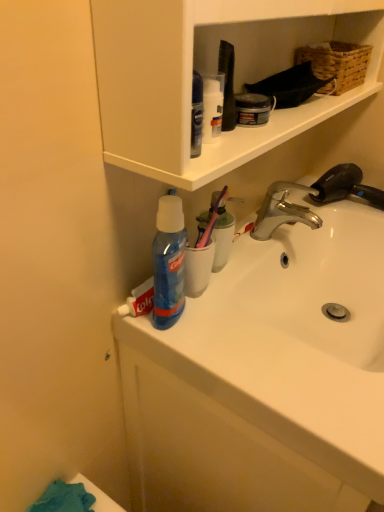
Question: Can you confirm if chrome metallic faucet at upper right is smaller than white glossy sink at center, arranged as the 2th sink when viewed from the top?

Choices:
 (A) no
 (B) yes

Answer: (B)

Question: Is chrome metallic faucet at upper right to the right of white glossy sink at center, arranged as the first sink when ordered from the bottom, from the viewer's perspective?

Choices:
 (A) no
 (B) yes

Answer: (A)

Question: Could you tell me if chrome metallic faucet at upper right is turned towards white glossy sink at center, arranged as the 2th sink when viewed from the top?

Choices:
 (A) yes
 (B) no

Answer: (B)

Question: Does chrome metallic faucet at upper right have a larger size compared to white glossy sink at center, arranged as the first sink when ordered from the bottom?

Choices:
 (A) no
 (B) yes

Answer: (A)

Question: Considering the relative sizes of chrome metallic faucet at upper right and white glossy sink at center, arranged as the first sink when ordered from the bottom, in the image provided, is chrome metallic faucet at upper right thinner than white glossy sink at center, arranged as the first sink when ordered from the bottom,?

Choices:
 (A) no
 (B) yes

Answer: (B)

Question: Is chrome metallic faucet at upper right looking in the opposite direction of white glossy sink at center, arranged as the first sink when ordered from the bottom?

Choices:
 (A) yes
 (B) no

Answer: (B)

Question: Does white glossy sink at center, the 2th sink from the bottom, have a lesser width compared to white glossy sink at center, arranged as the first sink when ordered from the bottom?

Choices:
 (A) yes
 (B) no

Answer: (A)

Question: Is white glossy sink at center, the 2th sink from the bottom, further to camera compared to white glossy sink at center, arranged as the first sink when ordered from the bottom?

Choices:
 (A) yes
 (B) no

Answer: (A)

Question: Does white glossy sink at center, placed as the 1th sink when sorted from top to bottom, have a greater width compared to white glossy sink at center, arranged as the first sink when ordered from the bottom?

Choices:
 (A) yes
 (B) no

Answer: (B)

Question: Is white glossy sink at center, placed as the 1th sink when sorted from top to bottom, at the left side of white glossy sink at center, arranged as the first sink when ordered from the bottom?

Choices:
 (A) no
 (B) yes

Answer: (A)

Question: Does white glossy sink at center, the 2th sink from the bottom, have a larger size compared to white glossy sink at center, arranged as the first sink when ordered from the bottom?

Choices:
 (A) no
 (B) yes

Answer: (A)

Question: From a real-world perspective, is white glossy sink at center, the 2th sink from the bottom, beneath white glossy sink at center, arranged as the 2th sink when viewed from the top?

Choices:
 (A) yes
 (B) no

Answer: (B)

Question: Considering the relative sizes of woven brown basket at upper right and white glossy sink at center, placed as the 1th sink when sorted from top to bottom, in the image provided, is woven brown basket at upper right wider than white glossy sink at center, placed as the 1th sink when sorted from top to bottom,?

Choices:
 (A) no
 (B) yes

Answer: (A)